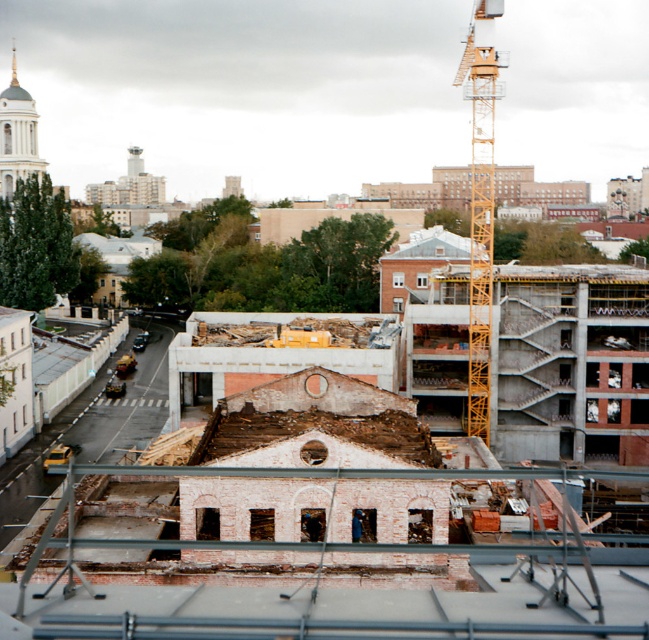
Does yellow asphalt road at lower left have a greater height compared to yellow metallic crane at upper right?

In fact, yellow asphalt road at lower left may be shorter than yellow metallic crane at upper right.

What are the coordinates of `yellow asphalt road at lower left` in the screenshot? It's located at (95, 424).